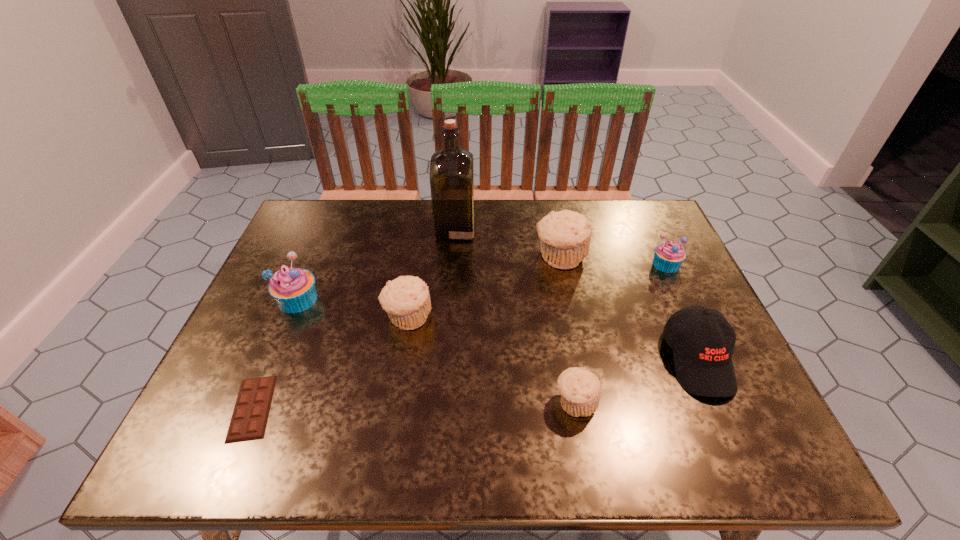
The height and width of the screenshot is (540, 960). I want to click on beige muffin that is the third closest one to the nearer blue muffin, so click(580, 390).

The image size is (960, 540). I want to click on beige muffin that stands as the third closest to the nearer blue muffin, so click(580, 390).

Identify the location of free space that satisfies the following two spatial constraints: 1. on the back side of the smaller blue muffin; 2. on the right side of the shortest object. (313, 264).

You are a GUI agent. You are given a task and a screenshot of the screen. Output one action in this format:
    pyautogui.click(x=<x>, y=<y>)
    Task: Click on the vacant area that satisfies the following two spatial constraints: 1. on the label of the liquor; 2. on the left side of the nearest beige muffin
    
    Given the screenshot: What is the action you would take?
    pyautogui.click(x=443, y=402)